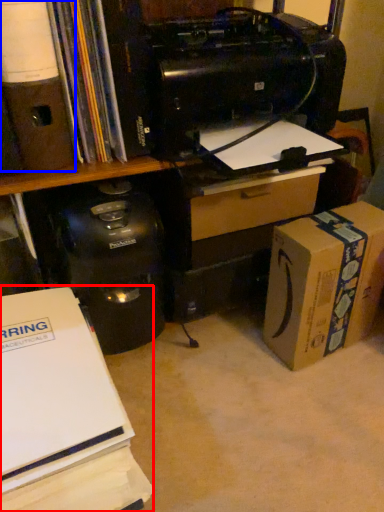
Question: Which object appears closest to the camera in this image, office supplies (highlighted by a red box) or office supplies (highlighted by a blue box)?

Choices:
 (A) office supplies
 (B) office supplies

Answer: (A)